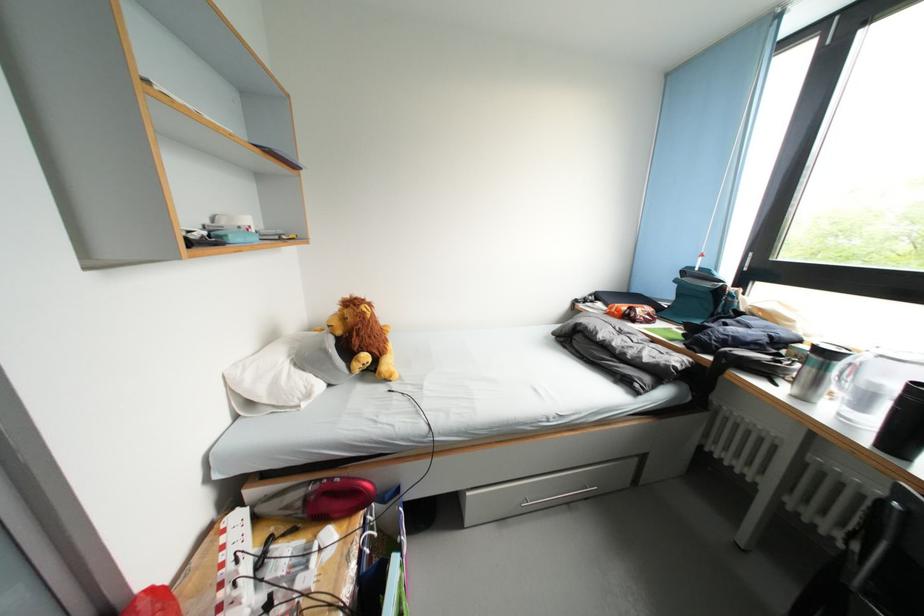
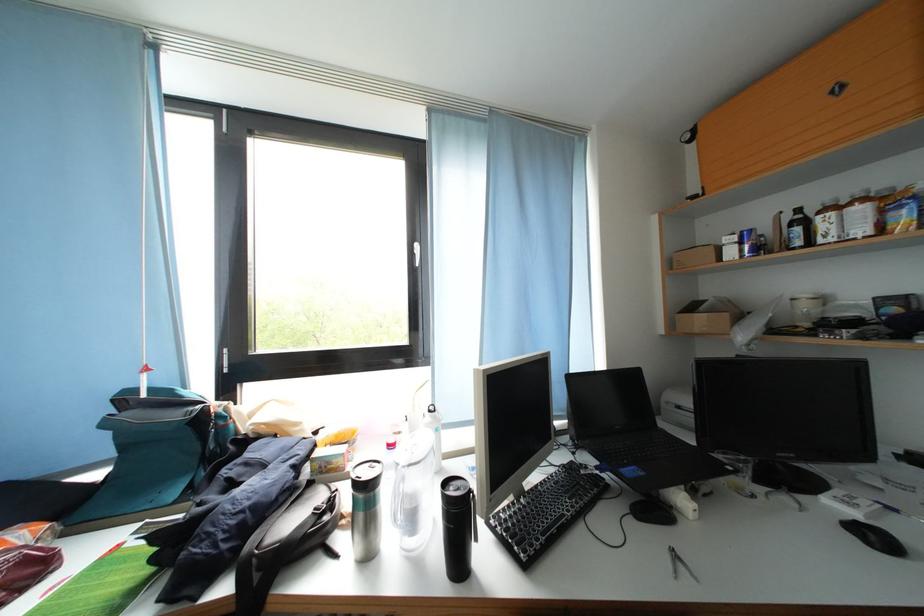
Where in the second image is the point corresponding to the point at 684,286 from the first image?

(114, 429)